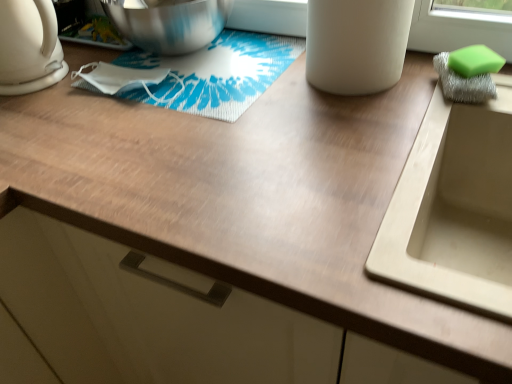
You are a GUI agent. You are given a task and a screenshot of the screen. Output one action in this format:
    pyautogui.click(x=<x>, y=<y>)
    Task: Click on the free space on the front side of white matte cup at upper center
    This screenshot has height=384, width=512.
    Given the screenshot: What is the action you would take?
    [365, 119]